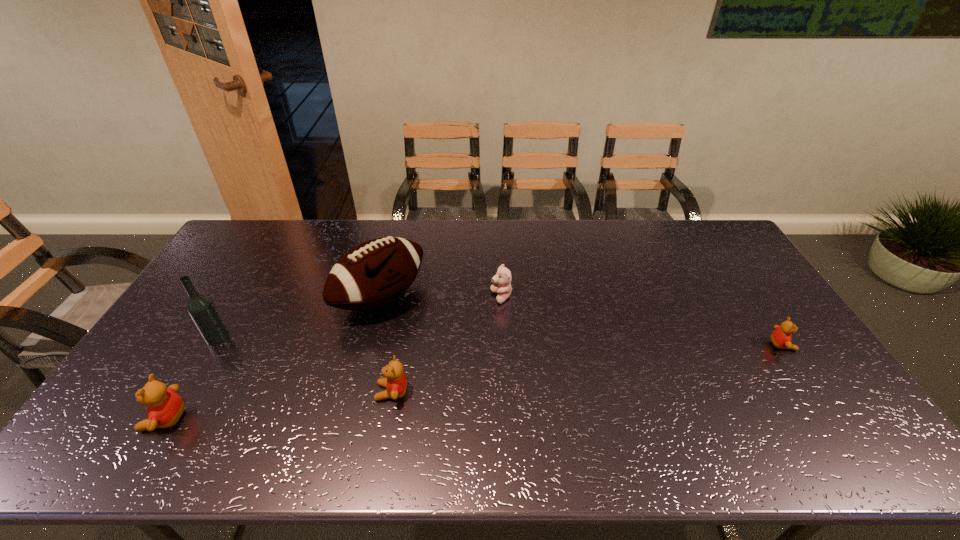
Locate an element on the screen. The width and height of the screenshot is (960, 540). the fourth shortest object is located at coordinates (164, 407).

The image size is (960, 540). Identify the location of the tallest teddy bear. click(x=164, y=407).

This screenshot has height=540, width=960. Find the location of `the third teddy bear from right to left`. the third teddy bear from right to left is located at coordinates (395, 382).

You are a GUI agent. You are given a task and a screenshot of the screen. Output one action in this format:
    pyautogui.click(x=<x>, y=<y>)
    Task: Click on the shortest teddy bear
    The width and height of the screenshot is (960, 540).
    Given the screenshot: What is the action you would take?
    pyautogui.click(x=781, y=338)

Identify the location of the shortest object. (781, 338).

Image resolution: width=960 pixels, height=540 pixels. I want to click on the fifth object from left to right, so click(x=503, y=278).

You are a GUI agent. You are given a task and a screenshot of the screen. Output one action in this format:
    pyautogui.click(x=<x>, y=<y>)
    Task: Click on the second teddy bear from right to left
    
    Given the screenshot: What is the action you would take?
    pyautogui.click(x=503, y=278)

I want to click on vodka, so click(x=200, y=308).

Locate an element on the screen. football (American) is located at coordinates (376, 272).

Find the location of a particular element. This screenshot has width=960, height=540. vacant space situated 0.370m on the front-facing side of the third teddy bear from right to left is located at coordinates (234, 392).